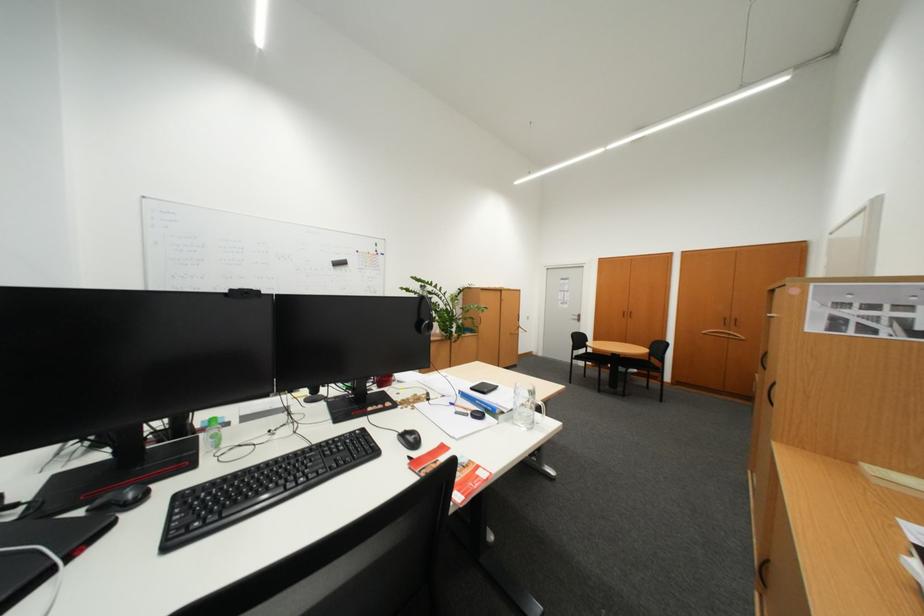
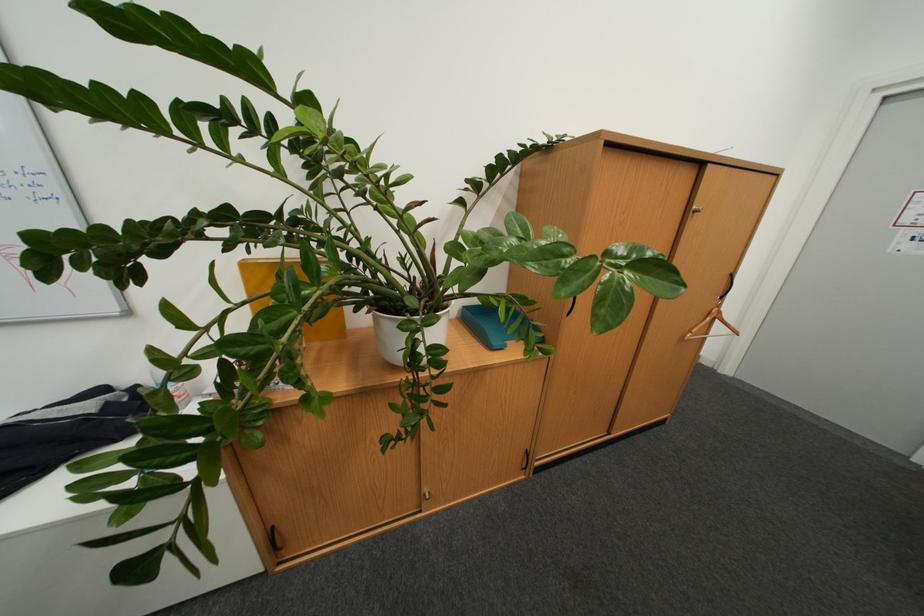
Question: In a continuous first-person perspective shot, in which direction is the camera moving?

Choices:
 (A) Left
 (B) Right
 (C) Forward
 (D) Backward

Answer: (C)